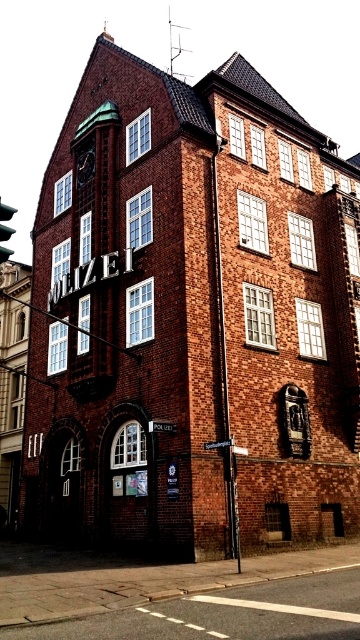
You are a tourist standing in front of the police station. You want to read the street sign but the brass clock face at upper left is blocking your view. Can you move around to see the metallic silver street sign at center?

The metallic silver street sign at center is behind the brass clock face at upper left, so you cannot see it without moving around the building or finding another angle where the brass clock face at upper left is no longer obstructing the view.

You are standing at the entrance of the police station and see two points marked on the ground. The first point is at coordinates point [78,150] and the second point is at point [3,216]. If you want to walk from the first point to the second point, which direction should you move relative to your current position?

Since point [78,150] is behind point [3,216], you should move forward towards the second point.

You are a tourist standing in front of the police station and want to read the street sign. Which direction should you turn your head to look at the metallic silver street sign at center from the brass clock face at upper left?

The brass clock face at upper left is positioned on the left side of the metallic silver street sign at center, so you should turn your head to the right to look at the metallic silver street sign at center from the brass clock face at upper left.